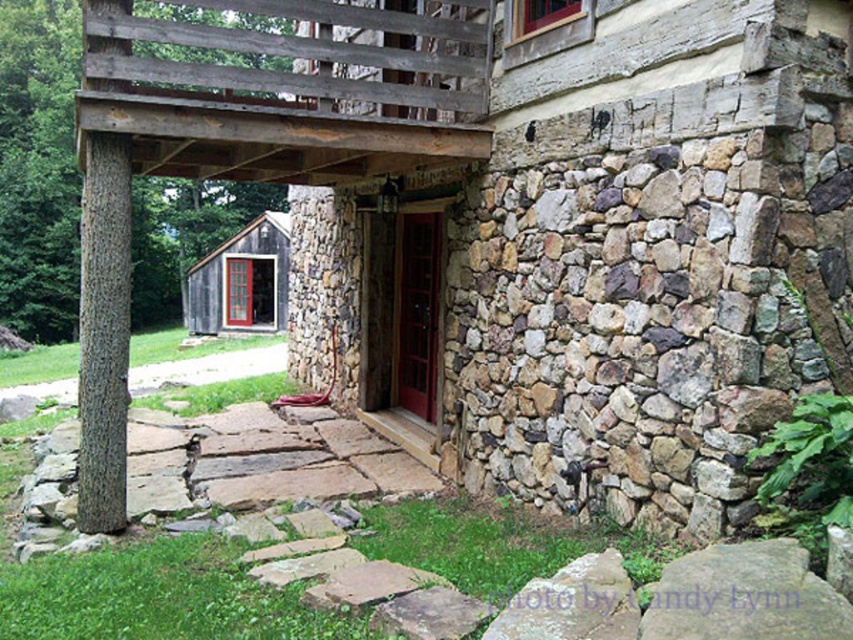
You are a painter standing at the base of the brown rough bark tree at left and want to paint the wooden cabin at lower left. Which object is wider so you can decide where to position your easel?

The brown rough bark tree at left is wider than the wooden cabin at lower left, so you should position your easel closer to the tree to capture its broader width.

You are standing in front of the wooden cabin at lower left and want to see the brown rough bark tree at left. Which direction should you turn to look towards the tree?

The brown rough bark tree at left is located to the left side of the wooden cabin at lower left, so you should turn to your left to face the tree.